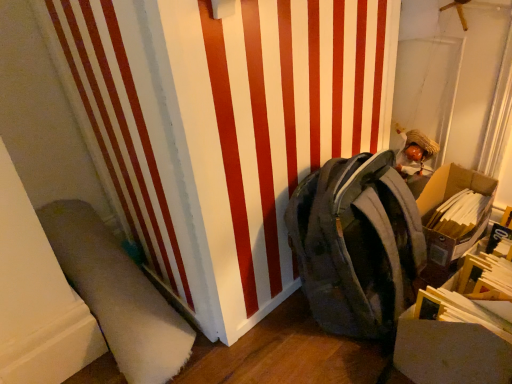
Where is `camouflage fabric backpack at center-right`? camouflage fabric backpack at center-right is located at coordinates (357, 244).

Image resolution: width=512 pixels, height=384 pixels. What do you see at coordinates (446, 201) in the screenshot? I see `cardboard box at right` at bounding box center [446, 201].

Find the location of `camouflage fabric backpack at center-right`. camouflage fabric backpack at center-right is located at coordinates (357, 244).

Considering the sizes of camouflage fabric backpack at center-right and white soft carpet at lower left in the image, is camouflage fabric backpack at center-right wider or thinner than white soft carpet at lower left?

In the image, camouflage fabric backpack at center-right appears to be more narrow than white soft carpet at lower left.

Considering the positions of points (293, 243) and (125, 344), is point (293, 243) closer to camera compared to point (125, 344)?

No, it is not.

In the image, is camouflage fabric backpack at center-right on the left side or the right side of white soft carpet at lower left?

camouflage fabric backpack at center-right is to the right of white soft carpet at lower left.

Considering the relative sizes of camouflage fabric backpack at center-right and white soft carpet at lower left in the image provided, is camouflage fabric backpack at center-right taller than white soft carpet at lower left?

Yes.

Is cardboard box at right positioned beyond the bounds of white soft carpet at lower left?

Yes, cardboard box at right is outside of white soft carpet at lower left.

Can you confirm if cardboard box at right is smaller than white soft carpet at lower left?

Yes.

From a real-world perspective, between cardboard box at right and white soft carpet at lower left, who is vertically higher?

white soft carpet at lower left, from a real-world perspective.

From a real-world perspective, which object rests below the other?

cardboard box at right, from a real-world perspective.

From the picture: Considering the positions of objects camouflage fabric backpack at center-right and cardboard box at right in the image provided, who is more to the right, camouflage fabric backpack at center-right or cardboard box at right?

cardboard box at right is more to the right.

In the image, is camouflage fabric backpack at center-right positioned in front of or behind cardboard box at right?

camouflage fabric backpack at center-right is positioned closer to the viewer than cardboard box at right.

From a real-world perspective, who is located higher, white soft carpet at lower left or cardboard box at right?

white soft carpet at lower left, from a real-world perspective.

Considering the positions of objects white soft carpet at lower left and cardboard box at right in the image provided, who is behind, white soft carpet at lower left or cardboard box at right?

cardboard box at right is further away from the camera.

Is white soft carpet at lower left to the left or to the right of cardboard box at right in the image?

From the image, it's evident that white soft carpet at lower left is to the left of cardboard box at right.

Is the depth of cardboard box at right greater than that of camouflage fabric backpack at center-right?

Yes, it is behind camouflage fabric backpack at center-right.

Are cardboard box at right and camouflage fabric backpack at center-right beside each other?

No, cardboard box at right is not with camouflage fabric backpack at center-right.

Is cardboard box at right thinner than camouflage fabric backpack at center-right?

Yes, cardboard box at right is thinner than camouflage fabric backpack at center-right.

Is cardboard box at right bigger or smaller than camouflage fabric backpack at center-right?

In the image, cardboard box at right appears to be smaller than camouflage fabric backpack at center-right.

Is white soft carpet at lower left turned away from camouflage fabric backpack at center-right?

That's not correct — white soft carpet at lower left is not looking away from camouflage fabric backpack at center-right.

Considering the points (138, 321) and (323, 291), which point is in front, point (138, 321) or point (323, 291)?

The point (323, 291) is closer.

From a real-world perspective, is white soft carpet at lower left physically above camouflage fabric backpack at center-right?

No, from a real-world perspective, white soft carpet at lower left is not over camouflage fabric backpack at center-right

Identify the location of wide that appears below the camouflage fabric backpack at center-right (from a real-world perspective). (117, 294).

Locate an element on the screen. backpack in front of the white soft carpet at lower left is located at coordinates (357, 244).

This screenshot has height=384, width=512. Identify the location of wide on the left side of cardboard box at right. (117, 294).

Looking at the image, which one is located further to camouflage fabric backpack at center-right, cardboard box at right or white soft carpet at lower left?

Based on the image, white soft carpet at lower left appears to be further to camouflage fabric backpack at center-right.

Considering their positions, is white soft carpet at lower left positioned closer to camouflage fabric backpack at center-right than cardboard box at right?

Based on the image, cardboard box at right appears to be nearer to camouflage fabric backpack at center-right.

From the image, which object appears to be nearer to white soft carpet at lower left, cardboard box at right or camouflage fabric backpack at center-right?

The object closer to white soft carpet at lower left is camouflage fabric backpack at center-right.

Considering their positions, is camouflage fabric backpack at center-right positioned closer to white soft carpet at lower left than cardboard box at right?

camouflage fabric backpack at center-right lies closer to white soft carpet at lower left than the other object.

Looking at this image, estimate the real-world distances between objects in this image. Which object is closer to cardboard box at right, white soft carpet at lower left or camouflage fabric backpack at center-right?

Among the two, camouflage fabric backpack at center-right is located nearer to cardboard box at right.

Considering their positions, is camouflage fabric backpack at center-right positioned further to cardboard box at right than white soft carpet at lower left?

Among the two, white soft carpet at lower left is located further to cardboard box at right.

Locate an element on the screen. The width and height of the screenshot is (512, 384). backpack situated between white soft carpet at lower left and cardboard box at right from left to right is located at coordinates (357, 244).